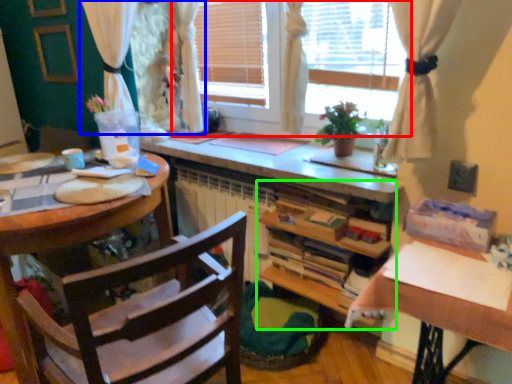
Question: Which is nearer to the window (highlighted by a red box)? curtain (highlighted by a blue box) or cabinetry (highlighted by a green box).

Choices:
 (A) curtain
 (B) cabinetry

Answer: (B)